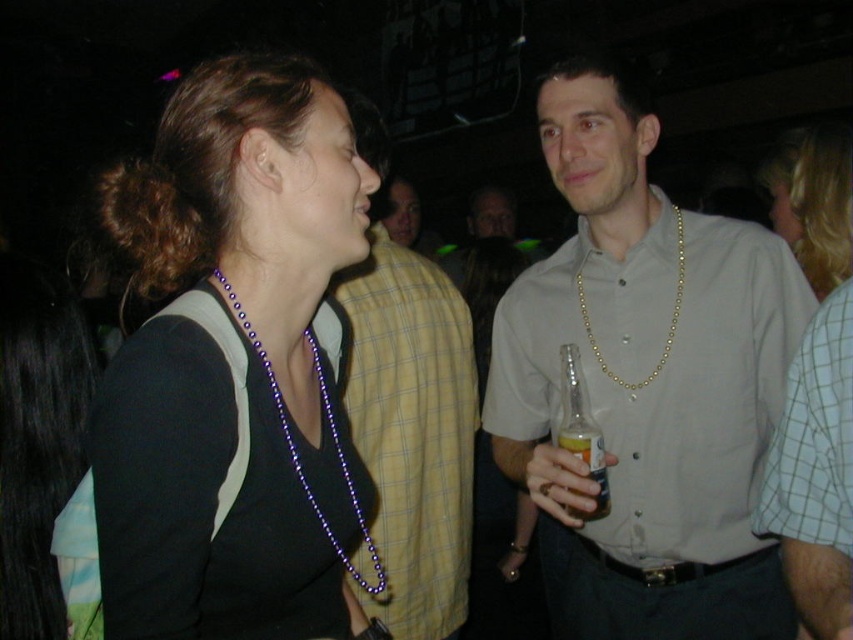
You are at a party and want to take a photo of the purple beaded necklace at upper left and the white checkered shirt at right. Which object should you focus on first to ensure both are in focus?

You should focus on the purple beaded necklace at upper left first because it is closer to the viewer than the white checkered shirt at right. By focusing on the closer object, the shirt will also be in focus due to the depth of field.